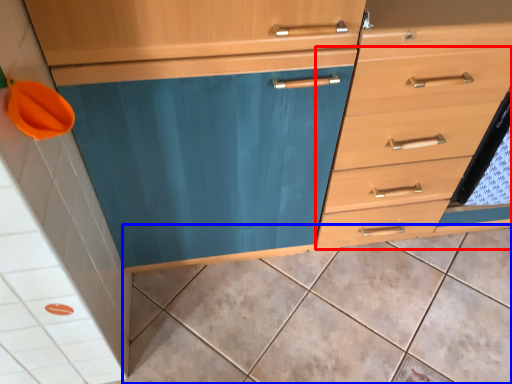
Question: Which object is further to the camera taking this photo, drawer (highlighted by a red box) or ceramic tile (highlighted by a blue box)?

Choices:
 (A) drawer
 (B) ceramic tile

Answer: (B)